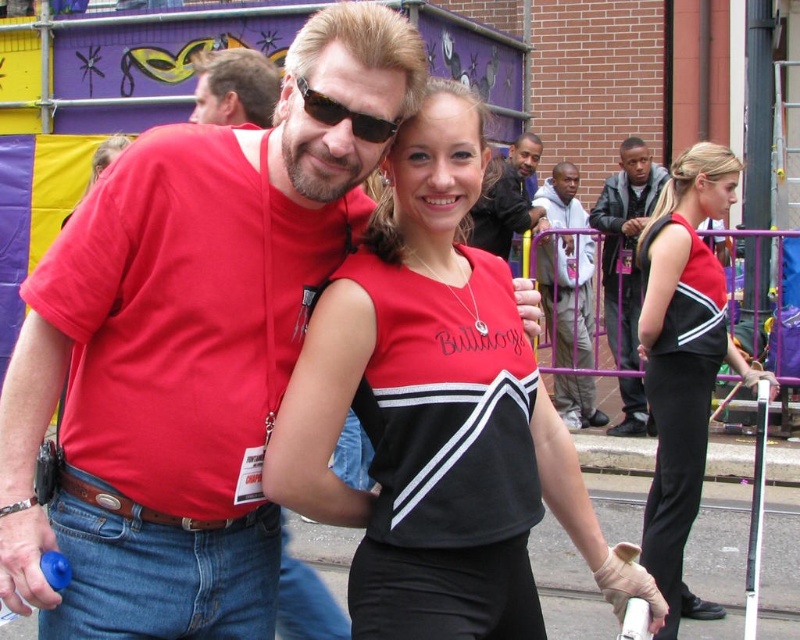
Between black leather jacket at right and sunglasses at center, which one is positioned lower?

black leather jacket at right is lower down.

Is point (652, 198) positioned behind point (366, 136)?

Yes, point (652, 198) is behind point (366, 136).

Identify the location of black leather jacket at right. The width and height of the screenshot is (800, 640). (625, 243).

At what (x,y) coordinates should I click in order to perform the action: click on black leather jacket at right. Please return your answer as a coordinate pair (x, y). The height and width of the screenshot is (640, 800). Looking at the image, I should click on (625, 243).

Between gray cotton hoodie at center and sunglasses at center, which one has more height?

gray cotton hoodie at center is taller.

The image size is (800, 640). In order to click on gray cotton hoodie at center in this screenshot , I will do pyautogui.click(x=568, y=296).

Find the location of `gray cotton hoodie at center`. gray cotton hoodie at center is located at coordinates (568, 296).

Where is `gray cotton hoodie at center`? This screenshot has height=640, width=800. gray cotton hoodie at center is located at coordinates (568, 296).

Is the position of matte black cheerleader uniform at center less distant than that of sunglasses at center?

No, it is not.

Who is higher up, matte black cheerleader uniform at center or sunglasses at center?

sunglasses at center

Locate an element on the screen. This screenshot has width=800, height=640. matte black cheerleader uniform at center is located at coordinates (437, 413).